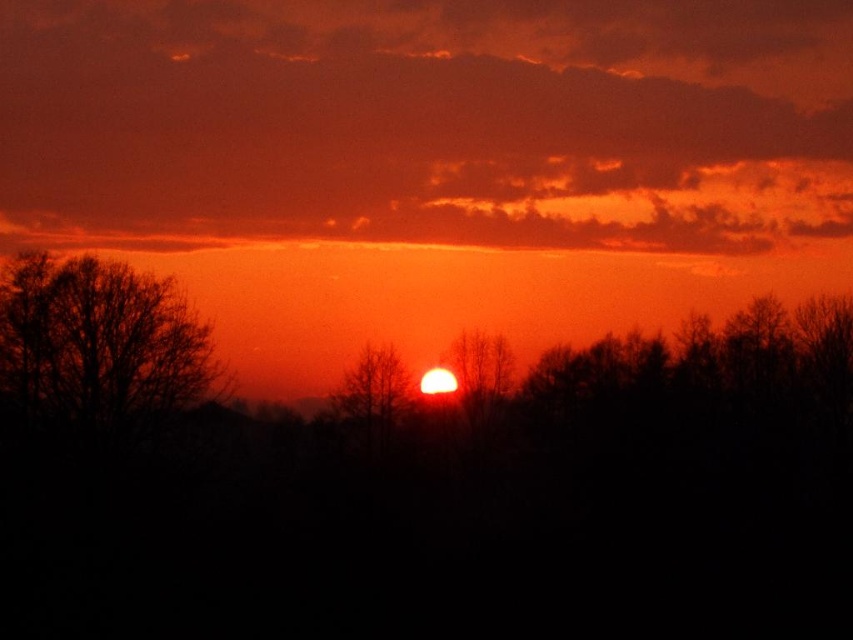
You are an artist trying to paint the sunset scene. You want to ensure the matte orange cloud at upper center and the silhouette tree at center are proportionally accurate. Which object should you make wider in your painting?

The matte orange cloud at upper center should be made wider in the painting since its width is larger than that of the silhouette tree at center according to the description.

You are standing in the sunset scene and notice two points in the image. The first point is at coordinate point (82, 346) and the second is at point (468, 333). Which point is closer to you?

Point (82, 346) is closer to the viewer than point (468, 333).